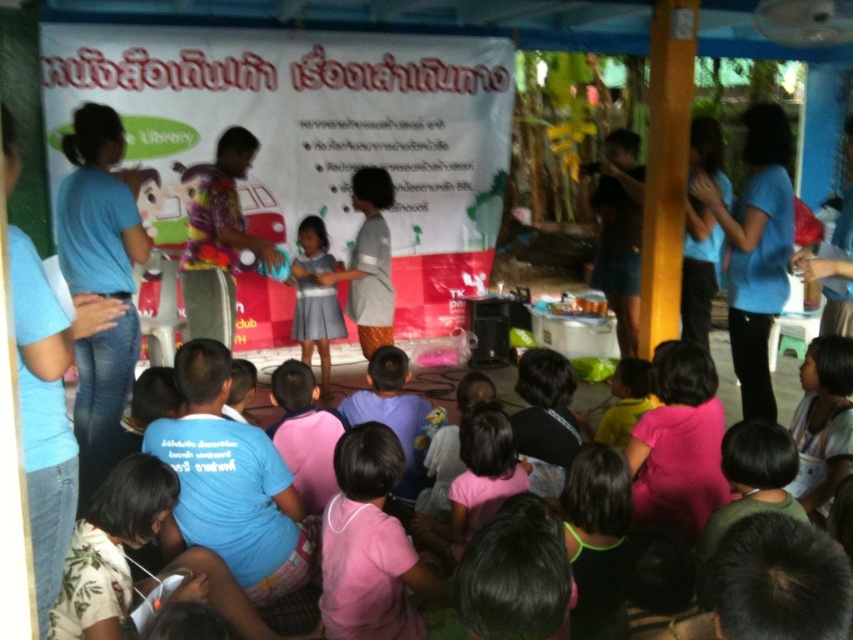
You are organizing a costume party and need to decide which shirt to wear. The pink matte shirt at lower center and the floral fabric shirt at center are your options. Based on their sizes, which one would you choose if you prefer a wider shirt?

The floral fabric shirt at center has a greater width than the pink matte shirt at lower center, so you should choose the floral fabric shirt at center for a wider option.